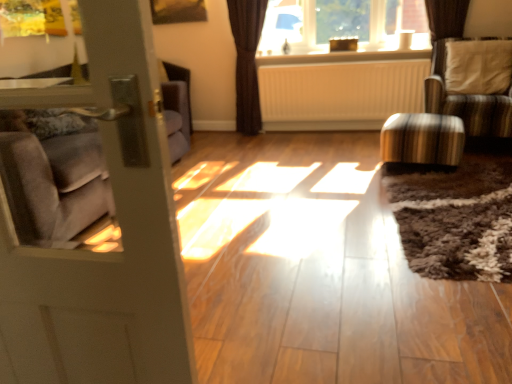
Find the location of a particular element. Image resolution: width=512 pixels, height=384 pixels. vacant space in front of metallic striped stool at right is located at coordinates (454, 189).